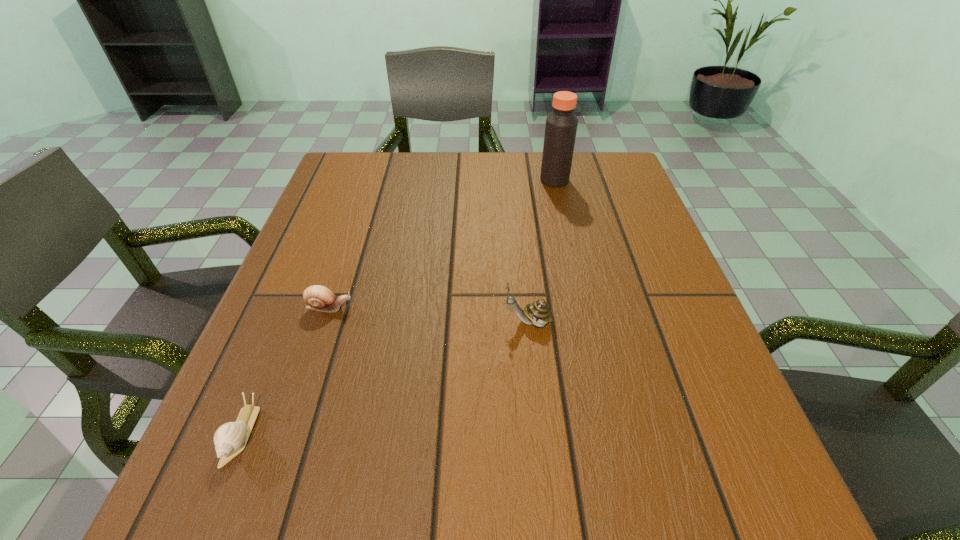
At what (x,y) coordinates should I click in order to perform the action: click on free space between the second tallest escargot and the farthest object. Please return your answer as a coordinate pair (x, y). Looking at the image, I should click on (442, 244).

Where is `free space between the rightmost escargot and the leftmost object`? This screenshot has width=960, height=540. free space between the rightmost escargot and the leftmost object is located at coordinates (385, 378).

This screenshot has width=960, height=540. What are the coordinates of `free space between the second tallest object and the rightmost object` in the screenshot? It's located at (541, 251).

Choose which object is the second nearest neighbor to the vinegar. Please provide its 2D coordinates. Your answer should be formatted as a tuple, i.e. [(x, y)], where the tuple contains the x and y coordinates of a point satisfying the conditions above.

[(319, 298)]

Where is `object that is the second nearest to the second object from left to right`? The height and width of the screenshot is (540, 960). object that is the second nearest to the second object from left to right is located at coordinates (537, 313).

Locate an element on the screen. This screenshot has width=960, height=540. escargot that is the closest to the shortest escargot is located at coordinates click(x=319, y=298).

Locate which escargot ranks third in proximity to the farthest object. Please provide its 2D coordinates. Your answer should be formatted as a tuple, i.e. [(x, y)], where the tuple contains the x and y coordinates of a point satisfying the conditions above.

[(230, 439)]

In order to click on vacant position in the image that satisfies the following two spatial constraints: 1. on the face of the rightmost escargot; 2. on the shell of the nearest escargot in this screenshot , I will do `click(540, 434)`.

You are a GUI agent. You are given a task and a screenshot of the screen. Output one action in this format:
    pyautogui.click(x=<x>, y=<y>)
    Task: Click on the vacant space that satisfies the following two spatial constraints: 1. on the face of the third object from left to right; 2. on the shell of the shortest escargot
    
    Given the screenshot: What is the action you would take?
    pyautogui.click(x=540, y=434)

What are the coordinates of `vacant position in the image that satisfies the following two spatial constraints: 1. on the face of the rightmost escargot; 2. on the shell of the leftmost escargot` in the screenshot? It's located at (540, 434).